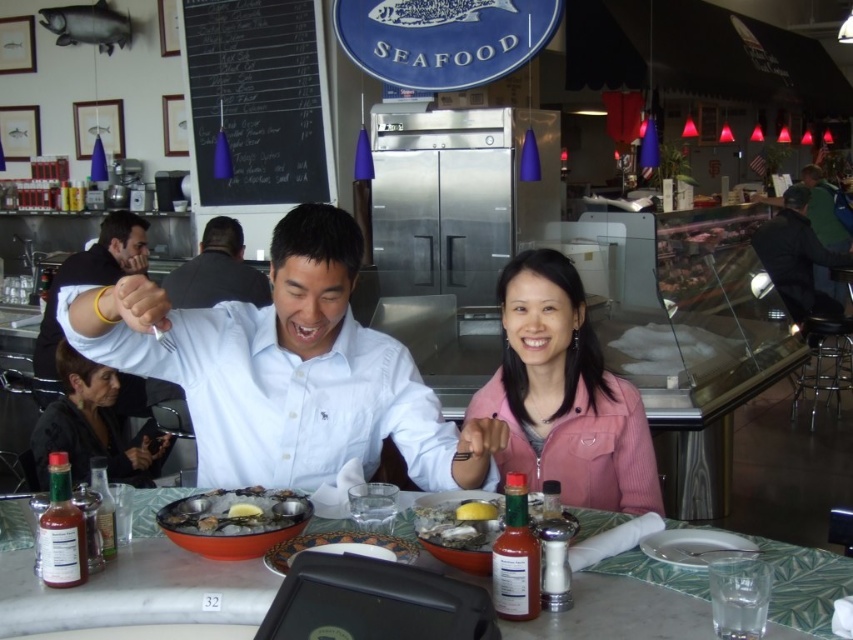
Is yellow rubber band at upper left wider than light blue shirt at center?

Incorrect, yellow rubber band at upper left's width does not surpass light blue shirt at center's.

Based on the photo, is yellow rubber band at upper left below light blue shirt at center?

Correct, yellow rubber band at upper left is located below light blue shirt at center.

You are a GUI agent. You are given a task and a screenshot of the screen. Output one action in this format:
    pyautogui.click(x=<x>, y=<y>)
    Task: Click on the yellow rubber band at upper left
    The image size is (853, 640).
    Given the screenshot: What is the action you would take?
    pyautogui.click(x=91, y=276)

Does black fabric jacket at lower left have a lesser height compared to shiny silver oysters at center?

No, black fabric jacket at lower left is not shorter than shiny silver oysters at center.

Between black fabric jacket at lower left and shiny silver oysters at center, which one has more height?

With more height is black fabric jacket at lower left.

Which is in front, point (84, 394) or point (258, 490)?

Point (258, 490)

Image resolution: width=853 pixels, height=640 pixels. I want to click on black fabric jacket at lower left, so click(93, 426).

Measure the distance between point [207,336] and camera.

Point [207,336] and camera are 5.54 feet apart.

Is white shirt at center below yellow creamy sauce at table center?

Incorrect, white shirt at center is not positioned below yellow creamy sauce at table center.

Find the location of `white shirt at center`. white shirt at center is located at coordinates (287, 371).